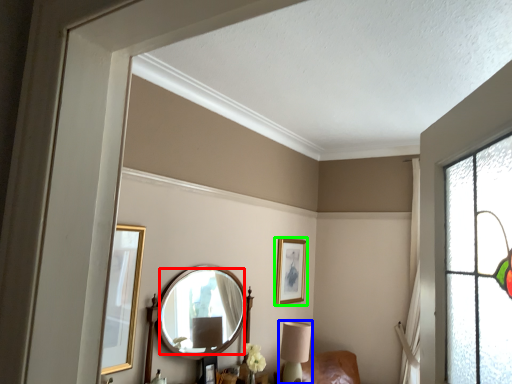
Question: Which object is the farthest from mirror (highlighted by a red box)? Choose among these: table lamp (highlighted by a blue box) or picture frame (highlighted by a green box).

Choices:
 (A) table lamp
 (B) picture frame

Answer: (B)